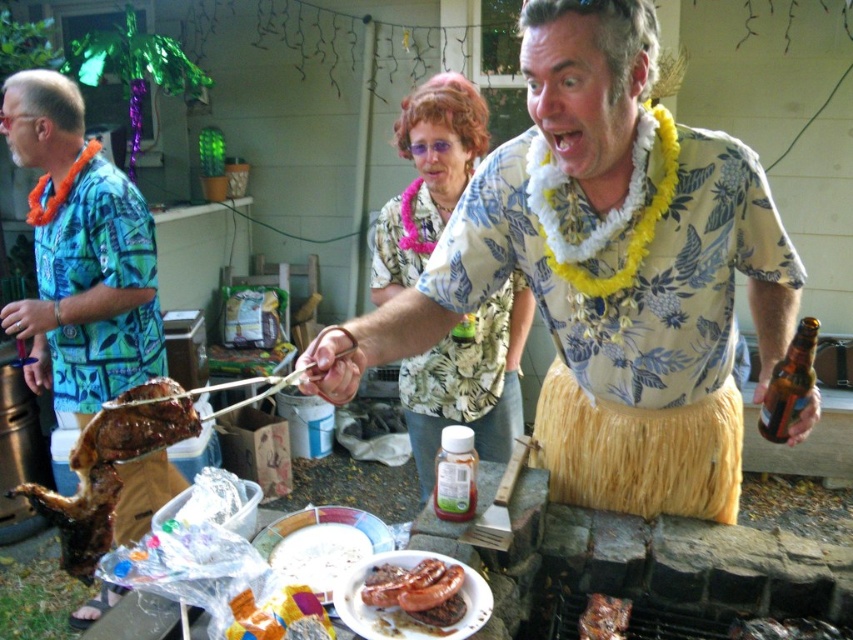
At what (x,y) coordinates should I click in order to perform the action: click on yellow grass skirt at center. Please return your answer as a coordinate pair (x, y). This screenshot has width=853, height=640. Looking at the image, I should click on (606, 273).

Who is lower down, golden crispy roasted chicken at center or charred meat at center?

charred meat at center is below.

In the scene shown: Can you confirm if golden crispy roasted chicken at center is positioned above charred meat at center?

Yes.

What do you see at coordinates (109, 467) in the screenshot? This screenshot has height=640, width=853. I see `golden crispy roasted chicken at center` at bounding box center [109, 467].

At what (x,y) coordinates should I click in order to perform the action: click on golden crispy roasted chicken at center. Please return your answer as a coordinate pair (x, y). The image size is (853, 640). Looking at the image, I should click on (109, 467).

Which is more to the right, yellow grass skirt at center or blue printed shirt at left?

yellow grass skirt at center is more to the right.

Does yellow grass skirt at center have a smaller size compared to blue printed shirt at left?

No, yellow grass skirt at center is not smaller than blue printed shirt at left.

Is point (668, 300) closer to camera compared to point (96, 305)?

Yes, point (668, 300) is closer to viewer.

Identify the location of yellow grass skirt at center. (606, 273).